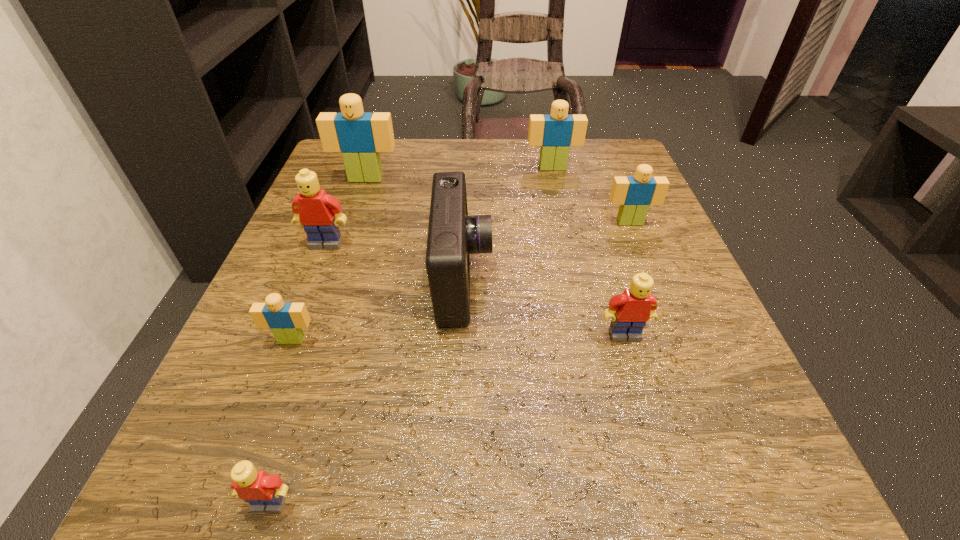
Locate an element on the screen. This screenshot has width=960, height=540. the fourth closest object relative to the third farthest Lego is located at coordinates (360, 136).

What are the coordinates of `object that is the seventh nearest to the second farthest object` in the screenshot? It's located at (265, 493).

Identify the location of the sixth closest Lego relative to the nearest Lego. (555, 133).

The width and height of the screenshot is (960, 540). I want to click on Lego that is the second closest to the farthest Lego, so click(360, 136).

Identify which beige Lego is located as the third nearest to the farthest beige Lego. Please provide its 2D coordinates. Your answer should be formatted as a tuple, i.e. [(x, y)], where the tuple contains the x and y coordinates of a point satisfying the conditions above.

[(286, 320)]

Locate an element on the screen. This screenshot has width=960, height=540. the second closest beige Lego to the rightmost yellow Lego is located at coordinates (286, 320).

Identify the location of the second closest yellow Lego to the nearest Lego. (636, 306).

Where is `yellow Lego that is the closest to the rightmost yellow Lego`? The image size is (960, 540). yellow Lego that is the closest to the rightmost yellow Lego is located at coordinates (265, 493).

Identify the location of free spot that satisfies the following two spatial constraints: 1. on the front-facing side of the camera; 2. on the front-facing side of the nearest Lego. (454, 503).